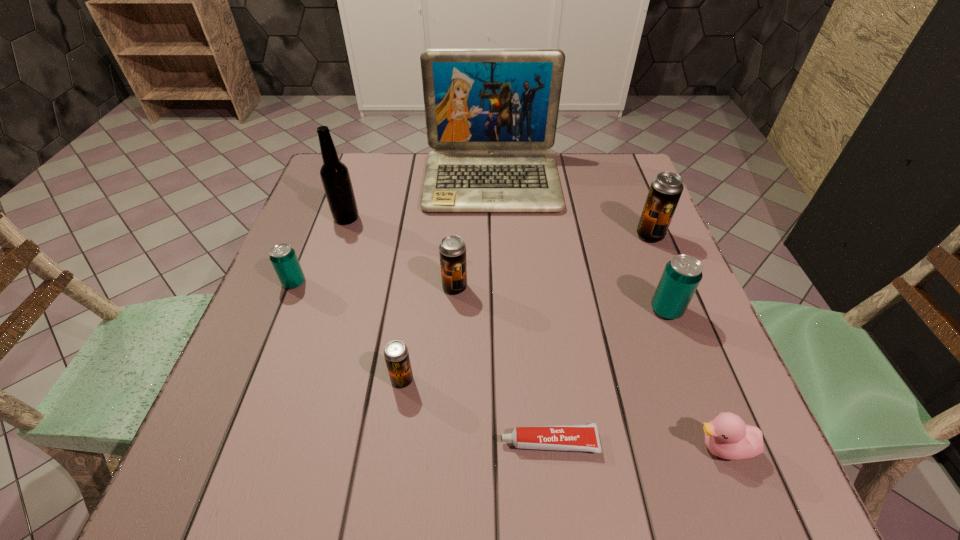
The image size is (960, 540). Find the location of `the leftmost beer can`. the leftmost beer can is located at coordinates (282, 256).

At what (x,y) coordinates should I click in order to perform the action: click on the second beer can from left to right. Please return your answer as a coordinate pair (x, y). Looking at the image, I should click on (396, 354).

This screenshot has height=540, width=960. I want to click on the seventh farthest object, so click(396, 354).

The image size is (960, 540). What are the coordinates of `duckling` in the screenshot? It's located at (727, 436).

Where is `pink duckling`? The image size is (960, 540). pink duckling is located at coordinates (727, 436).

Find the location of `the shortest object`. the shortest object is located at coordinates (582, 437).

This screenshot has height=540, width=960. I want to click on vacant area located on the screen of the laptop computer, so click(x=497, y=341).

This screenshot has height=540, width=960. In order to click on free location located 0.170m on the back of the second tallest object in this screenshot , I will do `click(361, 174)`.

Image resolution: width=960 pixels, height=540 pixels. Identify the location of free location located 0.070m on the back of the farthest beer can. (639, 210).

I want to click on free space located on the left of the second black beer can from left to right, so click(324, 287).